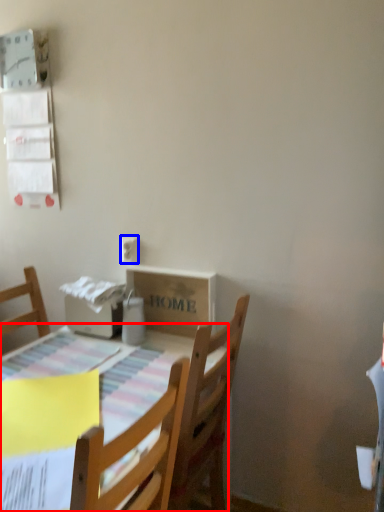
Question: Which object appears closest to the camera in this image, table (highlighted by a red box) or electric outlet (highlighted by a blue box)?

Choices:
 (A) table
 (B) electric outlet

Answer: (A)